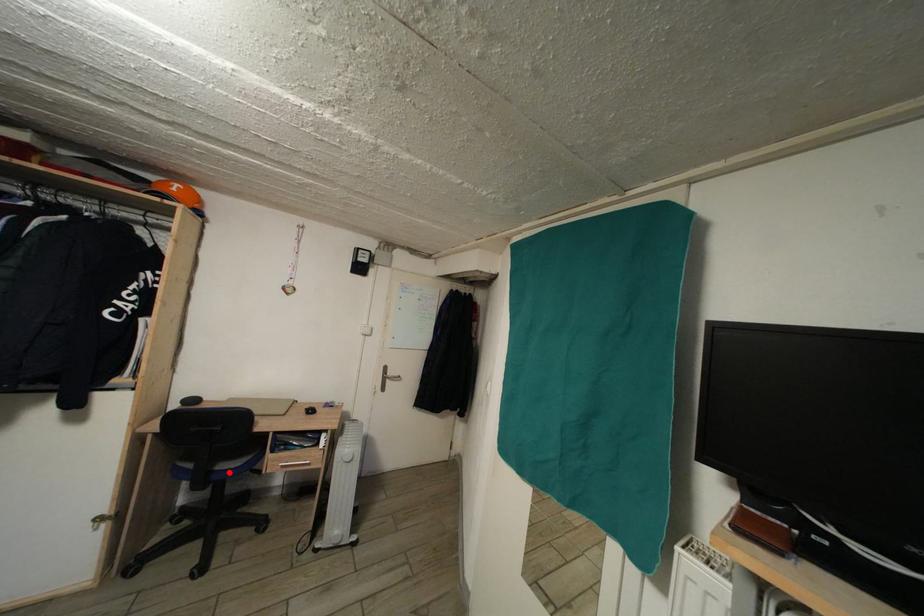
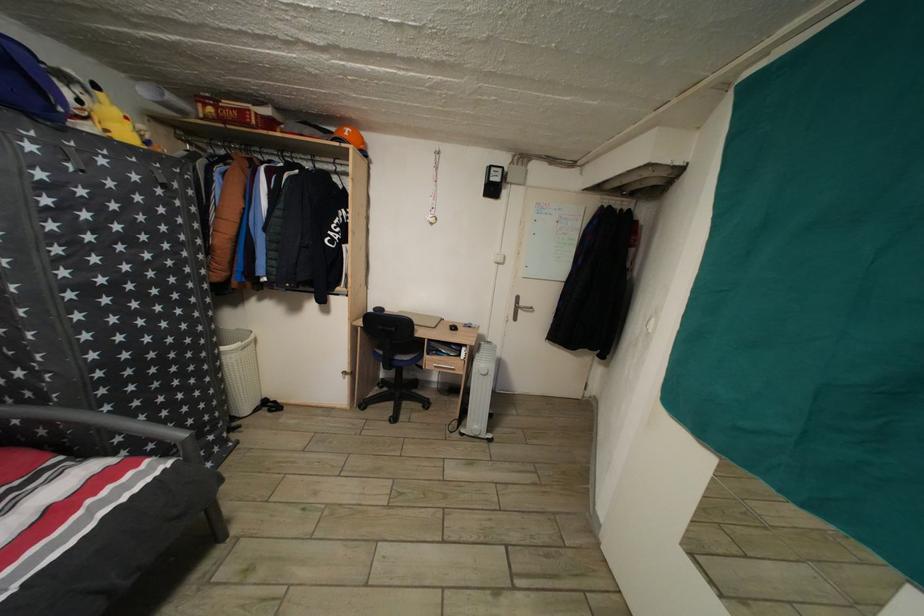
Find the pixel in the second image that matches the highlighted location in the first image.

(406, 363)